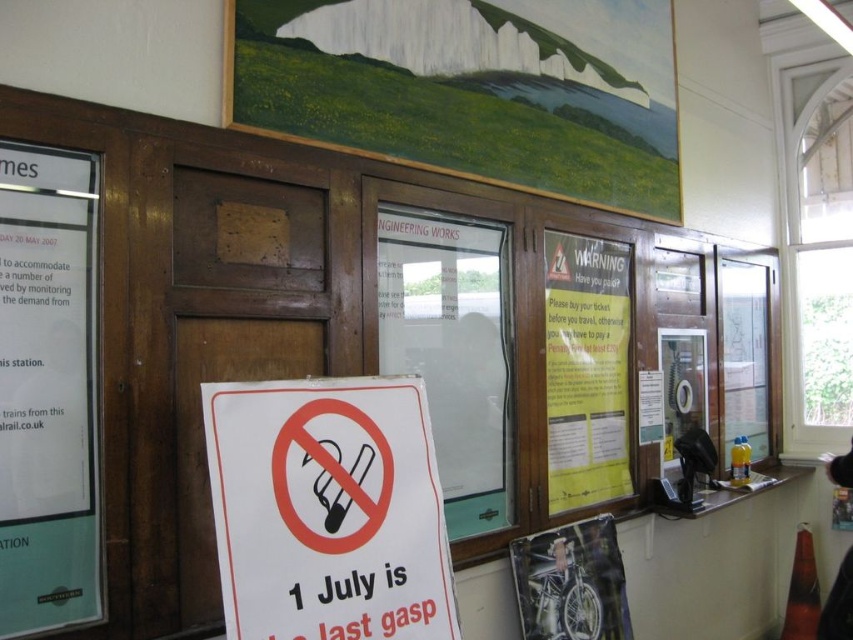
You are a traveler who just entered the train station ticket office and see the white paper sign at center and the green paper poster at left. Which one is shorter in height?

The white paper sign at center is not as tall as the green paper poster at left, so the white paper sign at center is shorter.

You are a traveler who wants to read both the white paper sign at center and the green paper poster at left. Which one do you need to look closer at?

The green paper poster at left is smaller than the white paper sign at center, so you need to look closer at the green paper poster at left to read it.